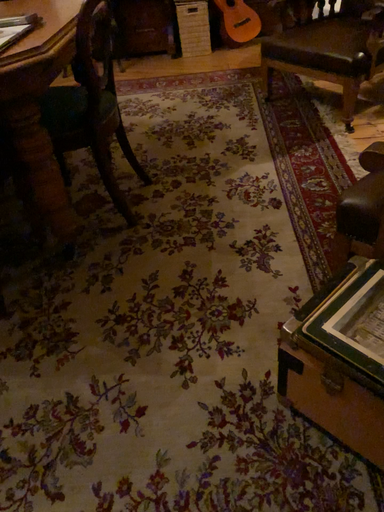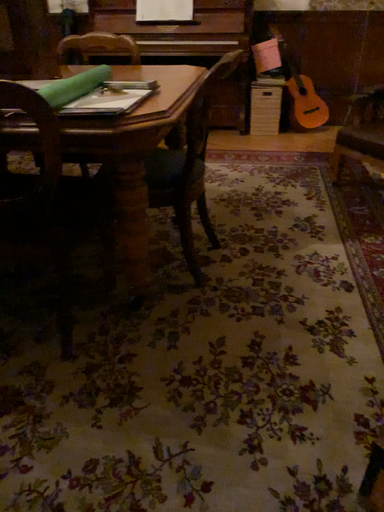
Question: How did the camera likely rotate when shooting the video?

Choices:
 (A) rotated downward
 (B) rotated upward

Answer: (B)